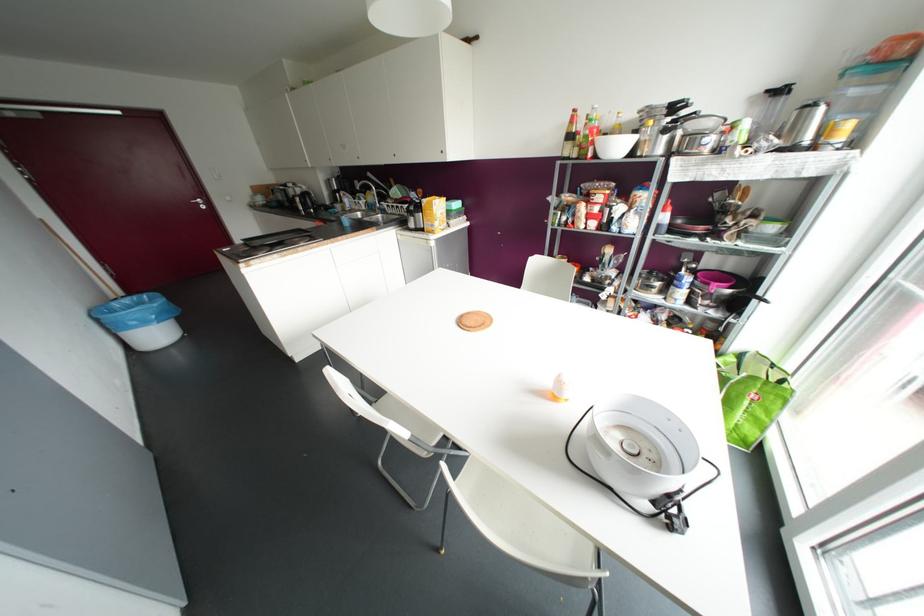
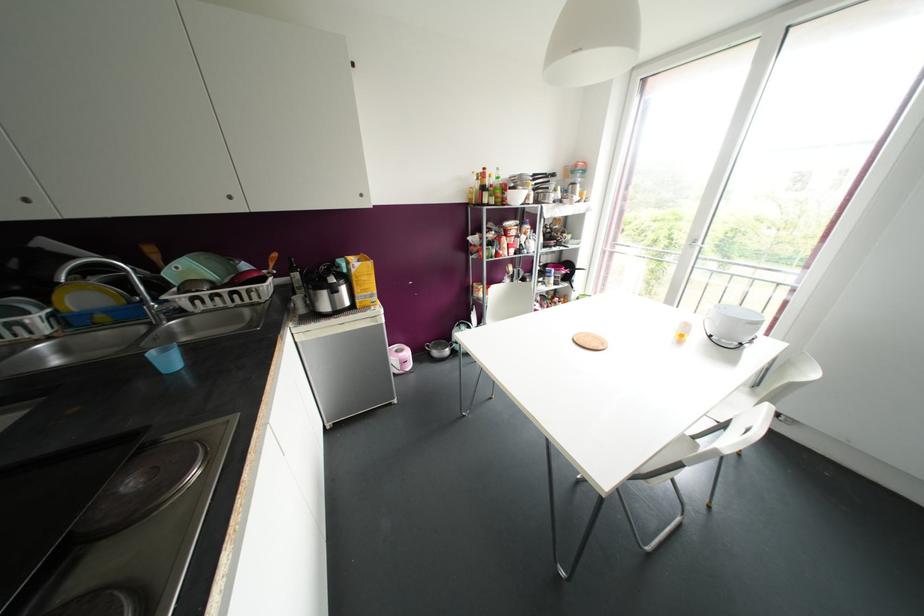
Locate, in the second image, the point that corresponds to (x=345, y=222) in the first image.

(168, 361)